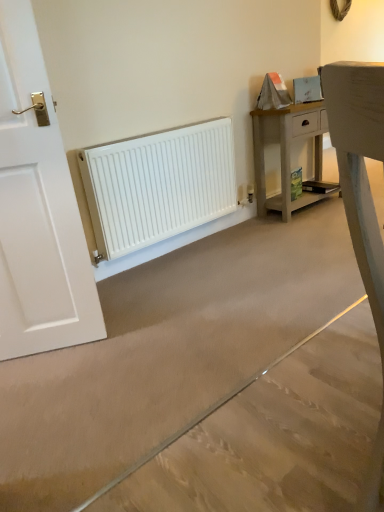
What do you see at coordinates (288, 153) in the screenshot? I see `light wood nightstand at upper right` at bounding box center [288, 153].

At what (x,y) coordinates should I click in order to perform the action: click on white matte radiator at lower left. Please return your answer as a coordinate pair (x, y). The height and width of the screenshot is (512, 384). Looking at the image, I should click on tap(158, 185).

Is point (127, 241) behind point (215, 403)?

Yes, it is behind point (215, 403).

Considering the relative sizes of white matte radiator at lower left and white matte radiator at center in the image provided, is white matte radiator at lower left thinner than white matte radiator at center?

Indeed, white matte radiator at lower left has a lesser width compared to white matte radiator at center.

Visually, is white matte radiator at lower left positioned to the left or to the right of white matte radiator at center?

In the image, white matte radiator at lower left appears on the left side of white matte radiator at center.

From the image's perspective, is white matte radiator at lower left positioned above or below white matte radiator at center?

Based on their image positions, white matte radiator at lower left is located above white matte radiator at center.

Can you tell me how much white matte radiator at center and white matte radiator at lower left differ in facing direction?

88.3 degrees separate the facing orientations of white matte radiator at center and white matte radiator at lower left.

Between white matte radiator at center and white matte radiator at lower left, which one appears on the left side from the viewer's perspective?

white matte radiator at lower left.

Can you confirm if white matte radiator at center is bigger than white matte radiator at lower left?

Correct, white matte radiator at center is larger in size than white matte radiator at lower left.

In the scene shown: From the image's perspective, is white matte radiator at center located above or below white matte radiator at lower left?

Clearly, from the image's perspective, white matte radiator at center is below white matte radiator at lower left.

From the image's perspective, which is below, white matte radiator at lower left or light wood nightstand at upper right?

white matte radiator at lower left.

Is white matte radiator at lower left not near light wood nightstand at upper right?

No.

Who is shorter, white matte radiator at lower left or light wood nightstand at upper right?

Standing shorter between the two is white matte radiator at lower left.

How many degrees apart are the facing directions of white matte radiator at lower left and light wood nightstand at upper right?

The angular difference between white matte radiator at lower left and light wood nightstand at upper right is 0.589 degrees.

Is light wood nightstand at upper right oriented towards white matte radiator at lower left?

No, light wood nightstand at upper right does not turn towards white matte radiator at lower left.

Can you confirm if light wood nightstand at upper right is smaller than white matte radiator at lower left?

Actually, light wood nightstand at upper right might be larger than white matte radiator at lower left.

Does point (261, 211) come behind point (141, 190)?

Yes, point (261, 211) is farther from viewer.

Measure the distance between light wood nightstand at upper right and white matte radiator at lower left.

They are 29.91 inches apart.

Which object is closer to the camera taking this photo, white matte radiator at center or light wood nightstand at upper right?

white matte radiator at center.

Are white matte radiator at center and light wood nightstand at upper right located far from each other?

Yes, white matte radiator at center is far from light wood nightstand at upper right.

Which object is wider, white matte radiator at center or light wood nightstand at upper right?

With larger width is white matte radiator at center.

Is white matte radiator at center turned away from light wood nightstand at upper right?

No, white matte radiator at center is not facing away from light wood nightstand at upper right.

Find the location of a particular element. The height and width of the screenshot is (512, 384). nightstand above the white matte radiator at center (from the image's perspective) is located at coordinates (288, 153).

Which of these two, light wood nightstand at upper right or white matte radiator at center, stands taller?

light wood nightstand at upper right is taller.

Which object is further away from the camera taking this photo, light wood nightstand at upper right or white matte radiator at center?

light wood nightstand at upper right is further from the camera.

Can we say light wood nightstand at upper right lies outside white matte radiator at center?

Yes, light wood nightstand at upper right is located beyond the bounds of white matte radiator at center.

Locate an element on the screen. radiator located behind the white matte radiator at center is located at coordinates (158, 185).

I want to click on concrete on the right side of white matte radiator at lower left, so click(272, 436).

Considering their positions, is white matte radiator at center positioned closer to white matte radiator at lower left than light wood nightstand at upper right?

light wood nightstand at upper right lies closer to white matte radiator at lower left than the other object.

Looking at the image, which one is located further to light wood nightstand at upper right, white matte radiator at lower left or white matte radiator at center?

The object further to light wood nightstand at upper right is white matte radiator at center.

Based on their spatial positions, is light wood nightstand at upper right or white matte radiator at lower left closer to white matte radiator at center?

The object closer to white matte radiator at center is white matte radiator at lower left.

Estimate the real-world distances between objects in this image. Which object is closer to light wood nightstand at upper right, white matte radiator at center or white matte radiator at lower left?

white matte radiator at lower left is closer to light wood nightstand at upper right.

Looking at the image, which one is located closer to white matte radiator at center, white matte radiator at lower left or light wood nightstand at upper right?

white matte radiator at lower left is positioned closer to the anchor white matte radiator at center.

From the image, which object appears to be farther from white matte radiator at lower left, light wood nightstand at upper right or white matte radiator at center?

white matte radiator at center.

The width and height of the screenshot is (384, 512). In order to click on radiator located between white matte radiator at center and light wood nightstand at upper right in the depth direction in this screenshot , I will do `click(158, 185)`.